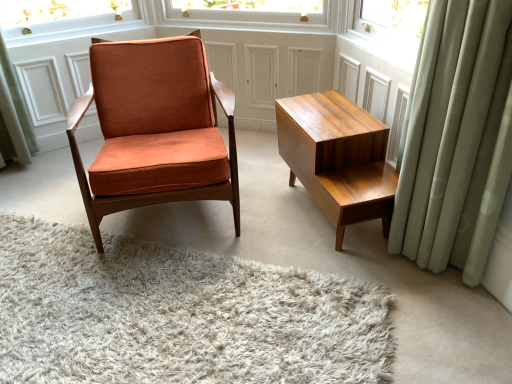
Question: From a real-world perspective, is orange velvet chair at center positioned over light green fabric curtain at right based on gravity?

Choices:
 (A) no
 (B) yes

Answer: (A)

Question: Can you confirm if orange velvet chair at center is thinner than light green fabric curtain at right?

Choices:
 (A) yes
 (B) no

Answer: (B)

Question: Is orange velvet chair at center oriented away from light green fabric curtain at right?

Choices:
 (A) no
 (B) yes

Answer: (A)

Question: Does orange velvet chair at center have a larger size compared to light green fabric curtain at right?

Choices:
 (A) yes
 (B) no

Answer: (A)

Question: Is orange velvet chair at center not close to light green fabric curtain at right?

Choices:
 (A) no
 (B) yes

Answer: (A)

Question: Is orange velvet chair at center completely or partially outside of light green fabric curtain at right?

Choices:
 (A) no
 (B) yes

Answer: (B)

Question: Is orange velvet chair at center not near wooden table at right?

Choices:
 (A) no
 (B) yes

Answer: (A)

Question: From the image's perspective, is orange velvet chair at center located above wooden table at right?

Choices:
 (A) no
 (B) yes

Answer: (B)

Question: Is orange velvet chair at center looking in the opposite direction of wooden table at right?

Choices:
 (A) no
 (B) yes

Answer: (A)

Question: Is orange velvet chair at center behind wooden table at right?

Choices:
 (A) no
 (B) yes

Answer: (A)

Question: Does orange velvet chair at center turn towards wooden table at right?

Choices:
 (A) no
 (B) yes

Answer: (A)

Question: Does orange velvet chair at center have a lesser width compared to wooden table at right?

Choices:
 (A) no
 (B) yes

Answer: (A)

Question: From the image's perspective, would you say wooden table at right is positioned over white shag rug at center?

Choices:
 (A) no
 (B) yes

Answer: (B)